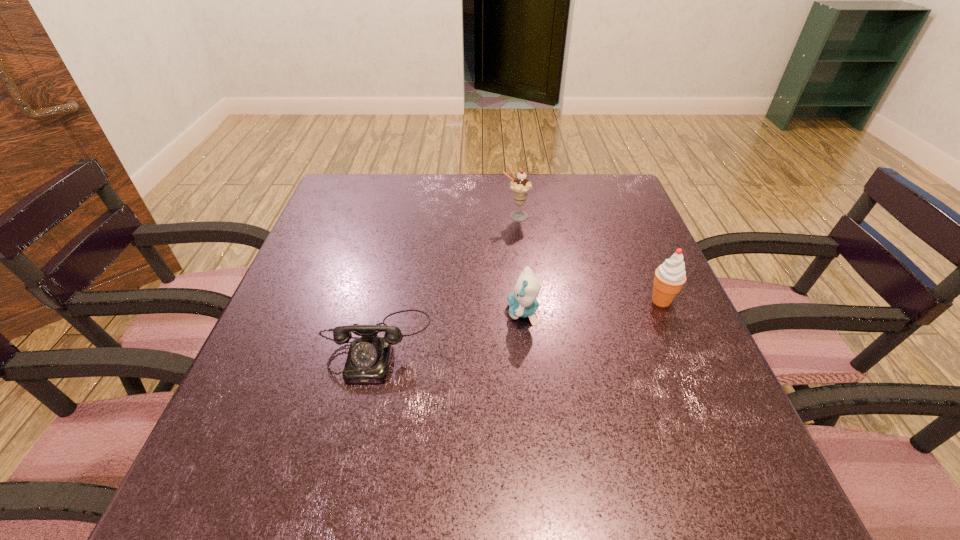
I want to click on vacant space at the far right corner, so click(594, 181).

You are a GUI agent. You are given a task and a screenshot of the screen. Output one action in this format:
    pyautogui.click(x=<x>, y=<y>)
    Task: Click on the vacant region between the rightmost object and the left icecream
    
    Given the screenshot: What is the action you would take?
    pyautogui.click(x=588, y=259)

Image resolution: width=960 pixels, height=540 pixels. Find the location of `vacant point located between the second shortest object and the rightmost object`. vacant point located between the second shortest object and the rightmost object is located at coordinates tap(592, 307).

Image resolution: width=960 pixels, height=540 pixels. I want to click on free spot between the kitten and the leftmost object, so click(449, 328).

The height and width of the screenshot is (540, 960). Identify the location of vacant point located between the third tallest object and the farthest object. (519, 264).

Locate an element on the screen. This screenshot has height=540, width=960. free space between the third tallest object and the shortest object is located at coordinates (449, 328).

Find the location of `vacant area between the rightmost object and the second shortest object`. vacant area between the rightmost object and the second shortest object is located at coordinates (592, 307).

Where is `empty space that is in between the left icecream and the nearer icecream`? This screenshot has width=960, height=540. empty space that is in between the left icecream and the nearer icecream is located at coordinates (588, 259).

I want to click on empty space that is in between the farthest object and the leftmost object, so click(x=446, y=280).

Locate an element on the screen. This screenshot has width=960, height=540. empty space between the leftmost object and the right icecream is located at coordinates (518, 322).